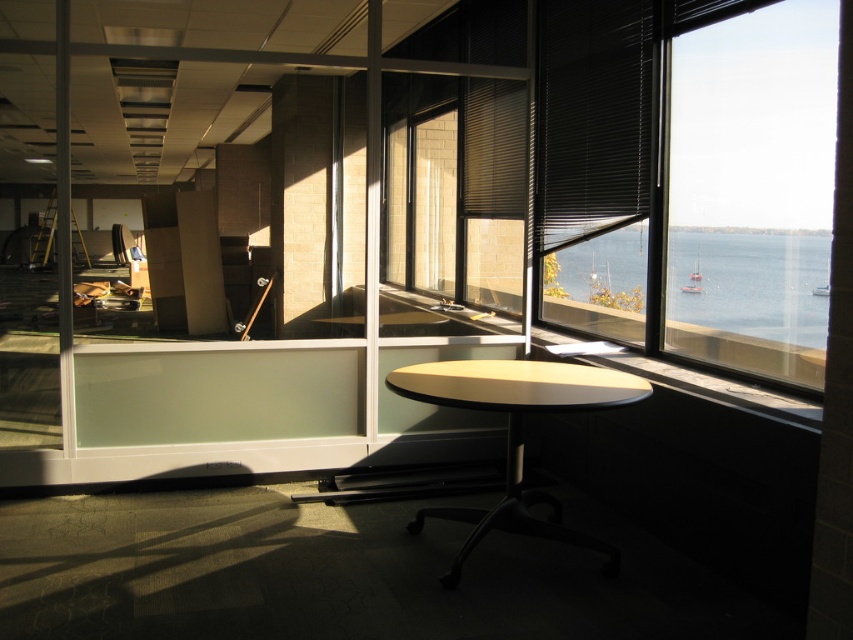
You are sitting at the light beige laminate table at center in the office. You want to look at the blue water at window right outside. In which direction should you turn your head to see it?

The blue water at window right is located above the light beige laminate table at center, so you should look upward to see it.

You are planning to place a large rectangular poster on either the transparent glass window at right or the light beige laminate table at center. Considering their sizes, which surface can accommodate the poster without folding it?

The light beige laminate table at center can accommodate the poster without folding it because the transparent glass window at right is narrower than the table.

You are planning to place a large poster on the wall behind the light beige laminate table at center. Considering the size of the blue water at window right, will the poster need to be larger than the table to cover the entire wall?

The blue water at window right is larger in size than the light beige laminate table at center. Therefore, the poster needs to be larger than the table to cover the entire wall.